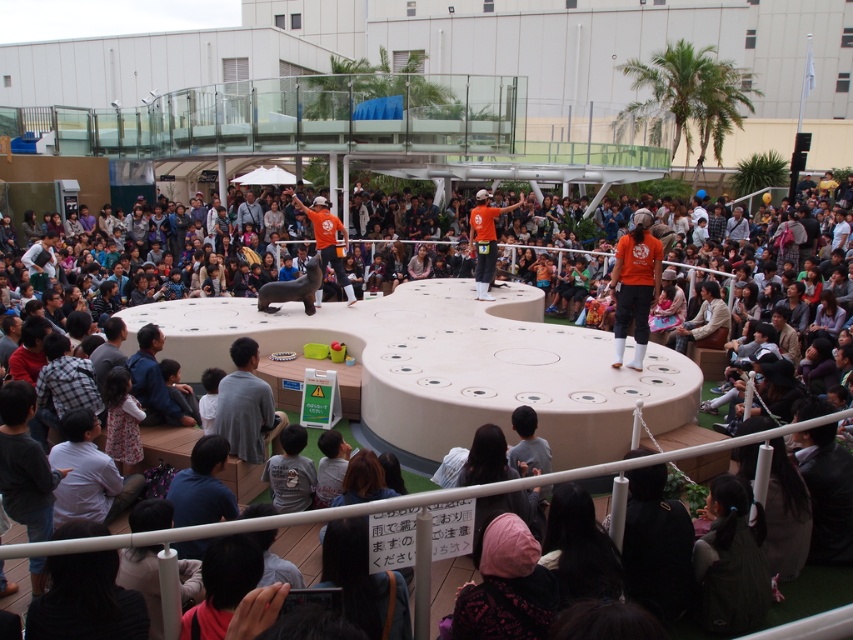
Question: Based on their relative distances, which object is nearer to the blue fabric jacket at lower left?

Choices:
 (A) orange fabric shirt at center
 (B) orange fabric man at center
 (C) gray fabric jacket at lower center

Answer: (C)

Question: Is blue fabric jacket at lower left thinner than orange fabric shirt at center?

Choices:
 (A) yes
 (B) no

Answer: (B)

Question: Which of these objects is positioned farthest from the blue fabric jacket at lower left?

Choices:
 (A) gray fabric jacket at lower center
 (B) orange fabric man at center

Answer: (B)

Question: Which point is farther to the camera?

Choices:
 (A) orange fabric man at center
 (B) gray fabric jacket at lower center
 (C) blue fabric jacket at lower left

Answer: (A)

Question: Does gray fabric jacket at lower center appear on the left side of orange fabric shirt at center?

Choices:
 (A) no
 (B) yes

Answer: (B)

Question: Is the position of blue fabric jacket at lower left more distant than that of orange fabric shirt at center?

Choices:
 (A) no
 (B) yes

Answer: (A)